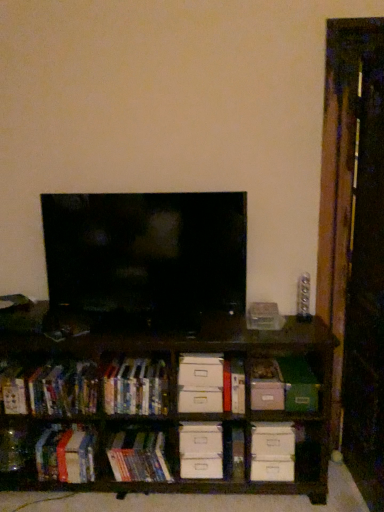
Find the location of `free space above hardcover books at left, acting as the 3th book starting from the left (from a real-world perspective)`. free space above hardcover books at left, acting as the 3th book starting from the left (from a real-world perspective) is located at coordinates (64, 372).